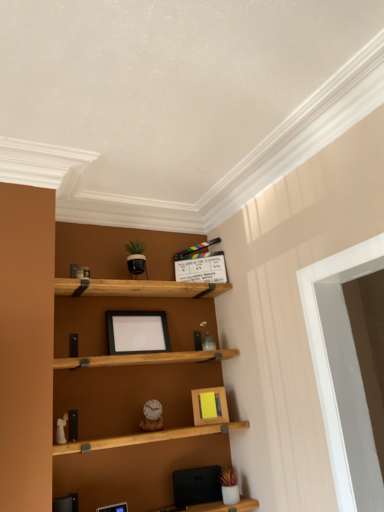
Question: From the image's perspective, is black matte picture frame at center, the second picture frame when ordered from back to front, beneath wooden picture frame at center, which appears as the third picture frame when viewed from the front?

Choices:
 (A) yes
 (B) no

Answer: (B)

Question: From a real-world perspective, is black matte picture frame at center, the third picture frame when ordered from bottom to top, positioned under wooden picture frame at center, which appears as the first picture frame when viewed from the back, based on gravity?

Choices:
 (A) yes
 (B) no

Answer: (B)

Question: Could you tell me if black matte picture frame at center, which is the second picture frame in left-to-right order, is facing wooden picture frame at center, which appears as the third picture frame when viewed from the front?

Choices:
 (A) no
 (B) yes

Answer: (A)

Question: Is black matte picture frame at center, the 2th picture frame in the front-to-back sequence, positioned behind wooden picture frame at center, which appears as the first picture frame when viewed from the right?

Choices:
 (A) no
 (B) yes

Answer: (A)

Question: Is black matte picture frame at center, the third picture frame when ordered from bottom to top, outside wooden picture frame at center, which is counted as the 3th picture frame, starting from the left?

Choices:
 (A) yes
 (B) no

Answer: (A)

Question: Relative to black matte picture frame at center, arranged as the first picture frame when viewed from the top, is wooden picture frame at center, which appears as the first picture frame when viewed from the right, in front or behind?

Choices:
 (A) front
 (B) behind

Answer: (B)

Question: From the image's perspective, relative to black matte picture frame at center, which is the second picture frame in left-to-right order, is wooden picture frame at center, which appears as the first picture frame when viewed from the right, above or below?

Choices:
 (A) above
 (B) below

Answer: (B)

Question: In terms of size, does wooden picture frame at center, the 2th picture frame in the bottom-to-top sequence, appear bigger or smaller than black matte picture frame at center, arranged as the first picture frame when viewed from the top?

Choices:
 (A) big
 (B) small

Answer: (B)

Question: In terms of width, does wooden picture frame at center, placed as the 2th picture frame when sorted from top to bottom, look wider or thinner when compared to black matte picture frame at center, the second picture frame when ordered from right to left?

Choices:
 (A) wide
 (B) thin

Answer: (B)

Question: Does point tap(362, 419) appear closer or farther from the camera than point tap(102, 507)?

Choices:
 (A) closer
 (B) farther

Answer: (A)

Question: From the image's perspective, is white glossy door at right positioned above or below wooden picture frame at center, positioned as the 1th picture frame in front-to-back order?

Choices:
 (A) above
 (B) below

Answer: (A)

Question: Based on their sizes in the image, would you say white glossy door at right is bigger or smaller than wooden picture frame at center, the third picture frame from the back?

Choices:
 (A) big
 (B) small

Answer: (A)

Question: Considering their positions, is white glossy door at right located in front of or behind wooden picture frame at center, the first picture frame positioned from the left?

Choices:
 (A) front
 (B) behind

Answer: (A)

Question: Considering the positions of point (362, 398) and point (145, 315), is point (362, 398) closer or farther from the camera than point (145, 315)?

Choices:
 (A) farther
 (B) closer

Answer: (B)

Question: Relative to black matte picture frame at center, the second picture frame when ordered from back to front, is white glossy door at right in front or behind?

Choices:
 (A) behind
 (B) front

Answer: (B)